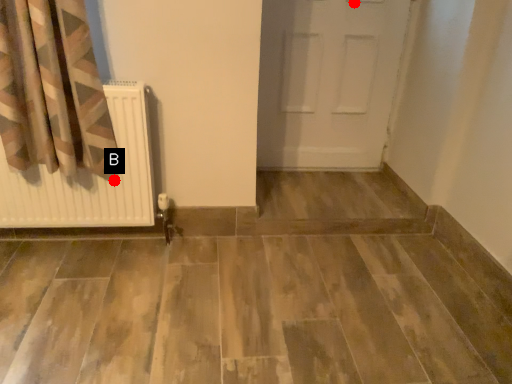
Question: Two points are circled on the image, labeled by A and B beside each circle. Which point is closer to the camera?

Choices:
 (A) A is closer
 (B) B is closer

Answer: (B)